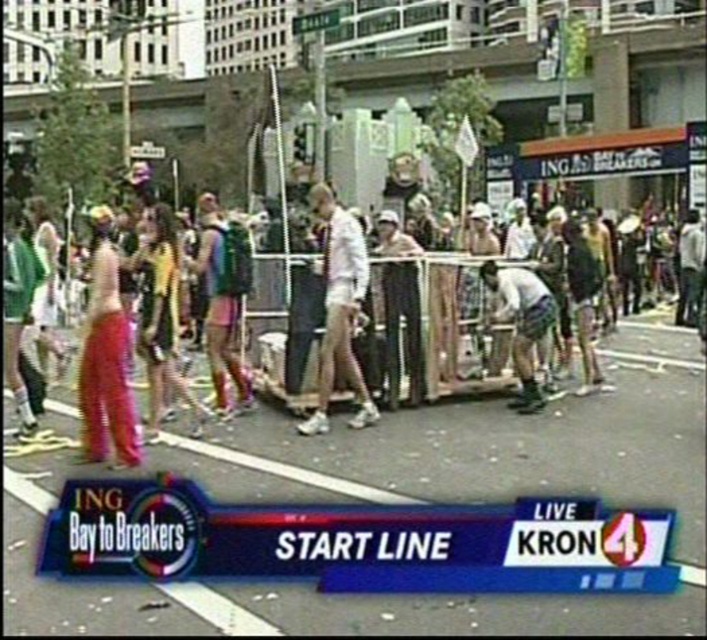
Is point (129, 344) more distant than point (450, 344)?

No, it is not.

Where is `shiny pink fabric at left`? This screenshot has width=707, height=640. shiny pink fabric at left is located at coordinates point(105,356).

Looking at this image, who is more distant from viewer, (x=128, y=348) or (x=127, y=298)?

The point (x=127, y=298) is more distant.

Where is `shiny pink fabric at left`? shiny pink fabric at left is located at coordinates (105, 356).

Which is above, white cotton shirt at center or multicolored fabric at center?

Positioned higher is multicolored fabric at center.

Between white cotton shirt at center and multicolored fabric at center, which one is positioned lower?

Positioned lower is white cotton shirt at center.

Is point (303, 433) farther from camera compared to point (4, 333)?

That is True.

The image size is (707, 640). Find the location of `white cotton shirt at center`. white cotton shirt at center is located at coordinates (339, 308).

Does shiny pink fabric at left appear on the left side of white cotton shirt at center?

Indeed, shiny pink fabric at left is positioned on the left side of white cotton shirt at center.

Between shiny pink fabric at left and white cotton shirt at center, which one has more height?

With more height is white cotton shirt at center.

Where is `shiny pink fabric at left`? This screenshot has width=707, height=640. shiny pink fabric at left is located at coordinates (105, 356).